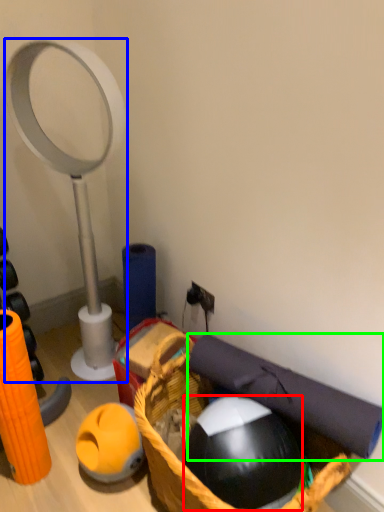
Question: Which object is the closest to the ball (highlighted by a red box)? Choose among these: magnifying glass (highlighted by a blue box) or yoga mat (highlighted by a green box).

Choices:
 (A) magnifying glass
 (B) yoga mat

Answer: (B)